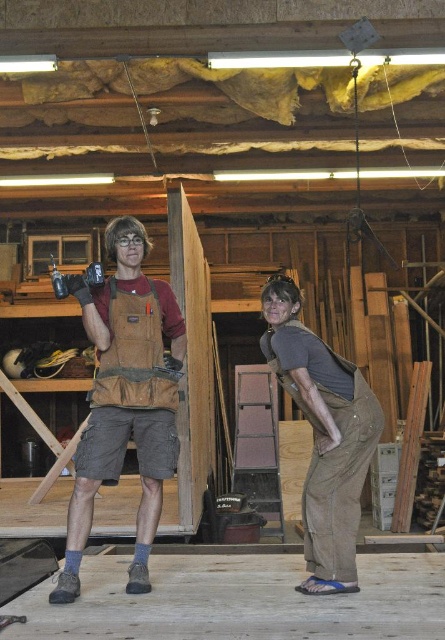
Question: Does brown/canvas tool vest at center have a larger size compared to brown cotton overalls at lower right?

Choices:
 (A) no
 (B) yes

Answer: (B)

Question: Does brown/canvas tool vest at center lie behind brown cotton overalls at lower right?

Choices:
 (A) yes
 (B) no

Answer: (B)

Question: Is brown/canvas tool vest at center thinner than brown cotton overalls at lower right?

Choices:
 (A) no
 (B) yes

Answer: (A)

Question: Which point is farther to the camera?

Choices:
 (A) brown cotton overalls at lower right
 (B) brown/canvas tool vest at center

Answer: (A)

Question: Which of the following is the farthest from the observer?

Choices:
 (A) (298, 348)
 (B) (110, 376)

Answer: (B)

Question: Which object is closer to the camera taking this photo?

Choices:
 (A) brown/canvas tool vest at center
 (B) brown cotton overalls at lower right

Answer: (A)